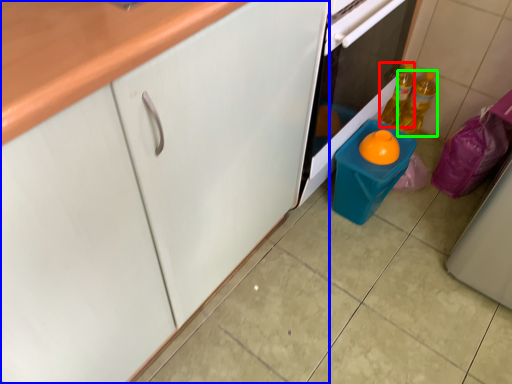
Question: Which object is positioned farthest from bottle (highlighted by a red box)? Select from cabinetry (highlighted by a blue box) and bottle (highlighted by a green box).

Choices:
 (A) cabinetry
 (B) bottle

Answer: (A)